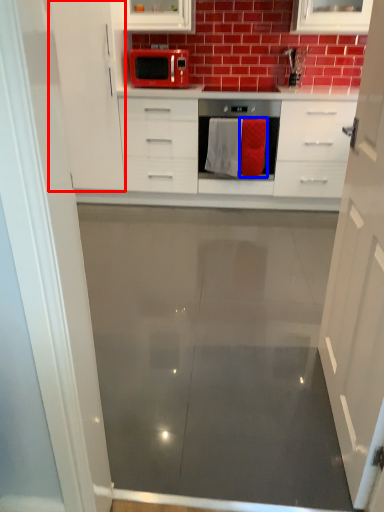
Question: Which of the following is the closest to the observer, cabinetry (highlighted by a red box) or material (highlighted by a blue box)?

Choices:
 (A) cabinetry
 (B) material

Answer: (A)